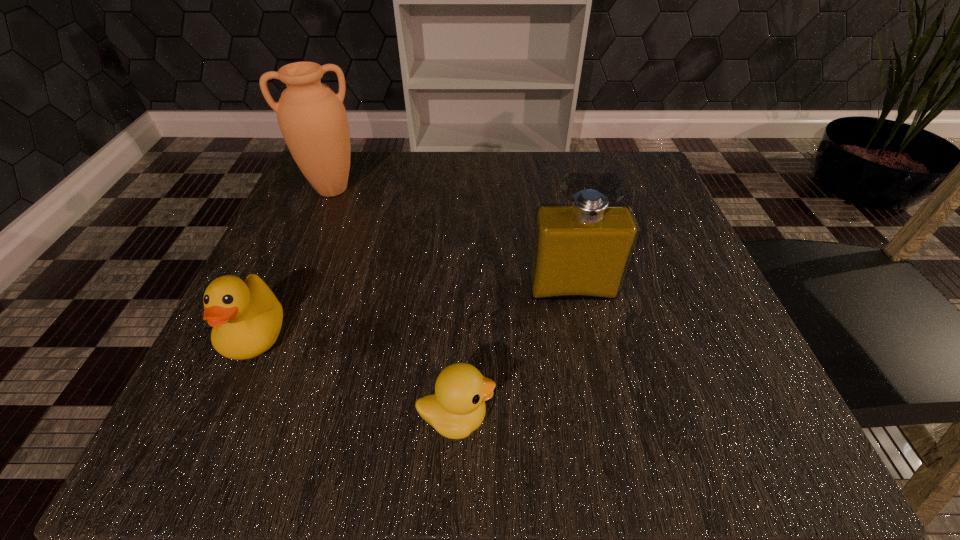
Where is `free space at the right edge of the desktop`? This screenshot has height=540, width=960. free space at the right edge of the desktop is located at coordinates (690, 286).

Where is `vacant area at the far left corner`? vacant area at the far left corner is located at coordinates (351, 154).

You are a GUI agent. You are given a task and a screenshot of the screen. Output one action in this format:
    pyautogui.click(x=<x>, y=<y>)
    Task: Click on the free space at the near right corner of the desktop
    Image resolution: width=960 pixels, height=540 pixels.
    Given the screenshot: What is the action you would take?
    pyautogui.click(x=720, y=460)

At what (x,y) coordinates should I click in order to perform the action: click on free space between the second tallest object and the urn. Please return your answer as a coordinate pair (x, y). Looking at the image, I should click on (452, 239).

The height and width of the screenshot is (540, 960). Identify the location of vacant space that is in between the nearer duck and the tallest object. (395, 303).

Find the location of a particular element. This screenshot has height=540, width=960. vacant area between the nearest object and the perfume is located at coordinates (x=514, y=353).

Where is `free space between the farther duck and the farthest object`? This screenshot has width=960, height=540. free space between the farther duck and the farthest object is located at coordinates (295, 262).

Find the location of `free space that is in between the third farthest object and the farthest object`. free space that is in between the third farthest object and the farthest object is located at coordinates click(x=295, y=262).

At what (x,y) coordinates should I click in order to perform the action: click on vacant space that's between the left duck and the shortest object. Please return your answer as a coordinate pair (x, y). Looking at the image, I should click on (356, 376).

At what (x,y) coordinates should I click in order to perform the action: click on free point between the farthest object and the shorter duck. Please return your answer as a coordinate pair (x, y). Image resolution: width=960 pixels, height=540 pixels. Looking at the image, I should click on (395, 303).